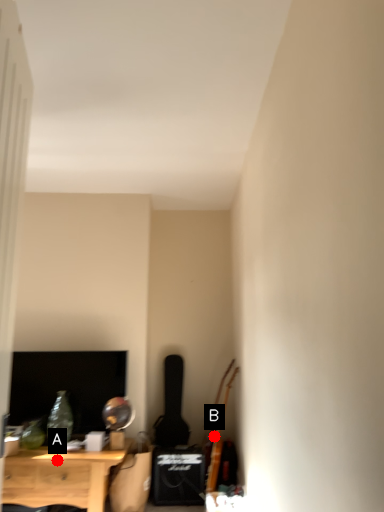
Question: Two points are circled on the image, labeled by A and B beside each circle. Which of the following is the closest to the observer?

Choices:
 (A) A is closer
 (B) B is closer

Answer: (A)